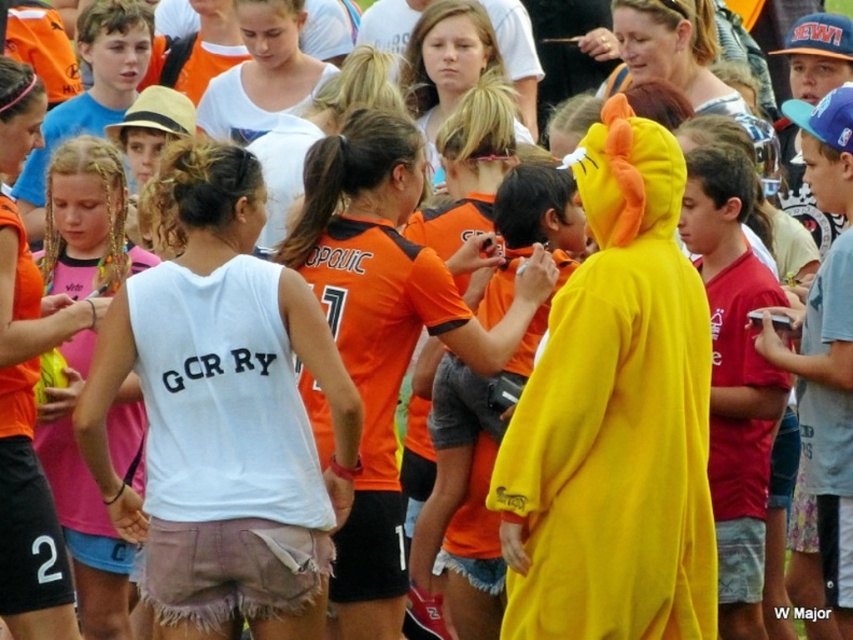
Question: Which point is closer to the camera?

Choices:
 (A) matte pink shirt at center
 (B) white cotton tank top at center
 (C) orange jersey at center

Answer: (B)

Question: Does white cotton tank top at center lie behind matte pink shirt at center?

Choices:
 (A) yes
 (B) no

Answer: (B)

Question: Which point appears closest to the camera in this image?

Choices:
 (A) (363, 355)
 (B) (67, 404)

Answer: (B)

Question: Is orange jersey at center bigger than matte pink shirt at center?

Choices:
 (A) no
 (B) yes

Answer: (B)

Question: Which object is the closest to the matte pink shirt at center?

Choices:
 (A) red cotton shirt at right
 (B) white cotton tank top at center

Answer: (B)

Question: Does white cotton tank top at center have a larger size compared to red cotton shirt at right?

Choices:
 (A) yes
 (B) no

Answer: (A)